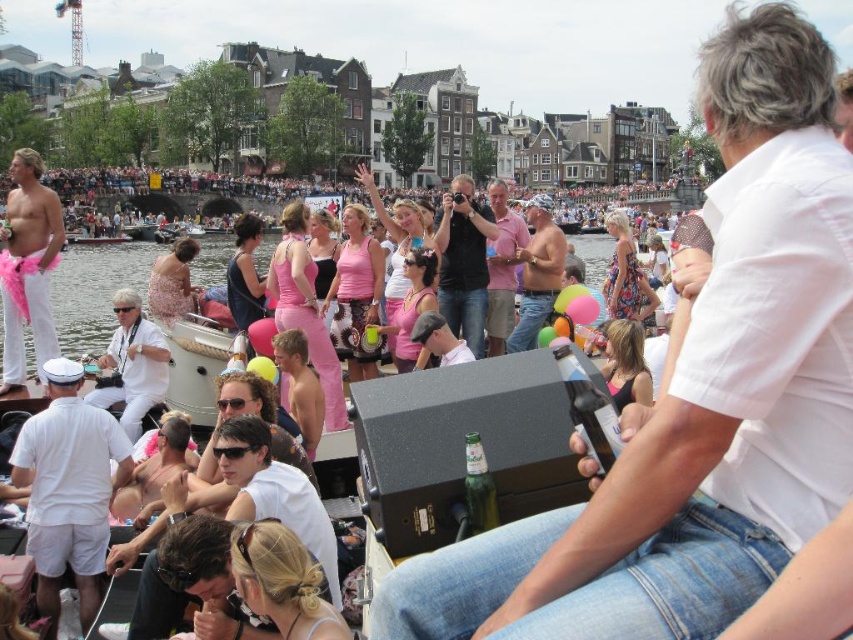
Where is `white matte sailor hat at left`? The image size is (853, 640). white matte sailor hat at left is located at coordinates (68, 486).

Is point (97, 417) positioned in front of point (154, 381)?

Yes, point (97, 417) is in front of point (154, 381).

What are the coordinates of `white matte sailor hat at left` in the screenshot? It's located at (68, 486).

Is white matte shirt at upper right thinner than pink fabric crowd at upper center?

Correct, white matte shirt at upper right's width is less than pink fabric crowd at upper center's.

Can you confirm if white matte shirt at upper right is smaller than pink fabric crowd at upper center?

Indeed, white matte shirt at upper right has a smaller size compared to pink fabric crowd at upper center.

Which is in front, point (785, 257) or point (78, 218)?

Point (785, 257)

Find the location of a particular element. The width and height of the screenshot is (853, 640). white matte shirt at upper right is located at coordinates (698, 397).

Does white matte shirt at upper right have a larger size compared to white matte sailor hat at left?

Indeed, white matte shirt at upper right has a larger size compared to white matte sailor hat at left.

Does white matte shirt at upper right appear under white matte sailor hat at left?

No, white matte shirt at upper right is not below white matte sailor hat at left.

You are a GUI agent. You are given a task and a screenshot of the screen. Output one action in this format:
    pyautogui.click(x=<x>, y=<y>)
    Task: Click on the white matte shirt at upper right
    The width and height of the screenshot is (853, 640).
    Given the screenshot: What is the action you would take?
    pyautogui.click(x=698, y=397)